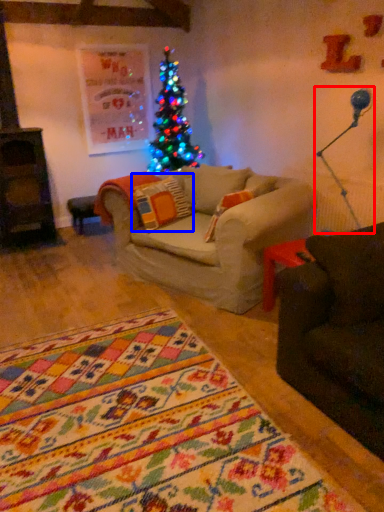
Question: Which object is closer to the camera taking this photo, lamp (highlighted by a red box) or pillow (highlighted by a blue box)?

Choices:
 (A) lamp
 (B) pillow

Answer: (A)